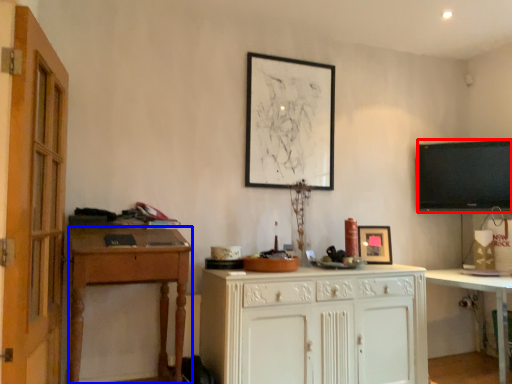
Question: Which object appears farthest to the camera in this image, television (highlighted by a red box) or desk (highlighted by a blue box)?

Choices:
 (A) television
 (B) desk

Answer: (A)